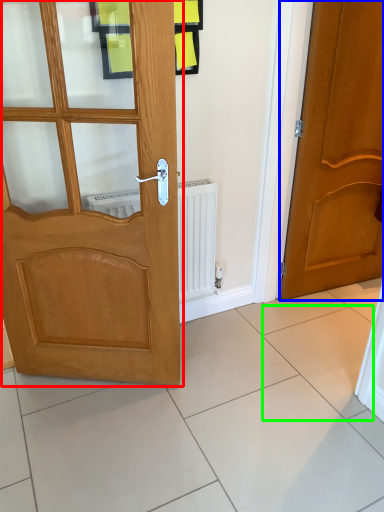
Question: Which object is the closest to the door (highlighted by a red box)? Choose among these: door (highlighted by a blue box) or ceramic tile (highlighted by a green box).

Choices:
 (A) door
 (B) ceramic tile

Answer: (B)